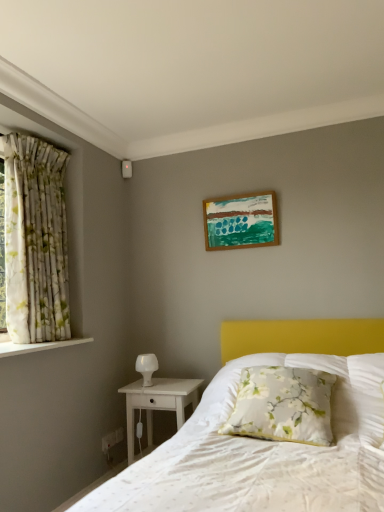
Question: Is wooden picture frame at upper center oriented towards floral fabric curtain at left?

Choices:
 (A) yes
 (B) no

Answer: (B)

Question: From a real-world perspective, does wooden picture frame at upper center sit lower than floral fabric curtain at left?

Choices:
 (A) no
 (B) yes

Answer: (A)

Question: Is wooden picture frame at upper center taller than floral fabric curtain at left?

Choices:
 (A) no
 (B) yes

Answer: (A)

Question: Can you confirm if wooden picture frame at upper center is positioned to the right of floral fabric curtain at left?

Choices:
 (A) no
 (B) yes

Answer: (B)

Question: Is wooden picture frame at upper center turned away from floral fabric curtain at left?

Choices:
 (A) yes
 (B) no

Answer: (B)

Question: Considering the relative positions of wooden picture frame at upper center and white wood nightstand at lower left in the image provided, is wooden picture frame at upper center to the left or to the right of white wood nightstand at lower left?

Choices:
 (A) right
 (B) left

Answer: (A)

Question: In terms of height, does wooden picture frame at upper center look taller or shorter compared to white wood nightstand at lower left?

Choices:
 (A) short
 (B) tall

Answer: (A)

Question: Is point (271, 236) positioned closer to the camera than point (132, 413)?

Choices:
 (A) farther
 (B) closer

Answer: (A)

Question: From the image's perspective, is wooden picture frame at upper center above or below white wood nightstand at lower left?

Choices:
 (A) below
 (B) above

Answer: (B)

Question: From a real-world perspective, relative to wooden picture frame at upper center, is floral fabric curtain at left vertically above or below?

Choices:
 (A) below
 (B) above

Answer: (A)

Question: Is floral fabric curtain at left wider or thinner than wooden picture frame at upper center?

Choices:
 (A) wide
 (B) thin

Answer: (A)

Question: In the image, is floral fabric curtain at left positioned in front of or behind wooden picture frame at upper center?

Choices:
 (A) front
 (B) behind

Answer: (A)

Question: In terms of height, does floral fabric curtain at left look taller or shorter compared to wooden picture frame at upper center?

Choices:
 (A) tall
 (B) short

Answer: (A)

Question: From their relative heights in the image, would you say wooden picture frame at upper center is taller or shorter than floral fabric pillow at center?

Choices:
 (A) tall
 (B) short

Answer: (A)

Question: Is wooden picture frame at upper center to the left or to the right of floral fabric pillow at center in the image?

Choices:
 (A) right
 (B) left

Answer: (B)